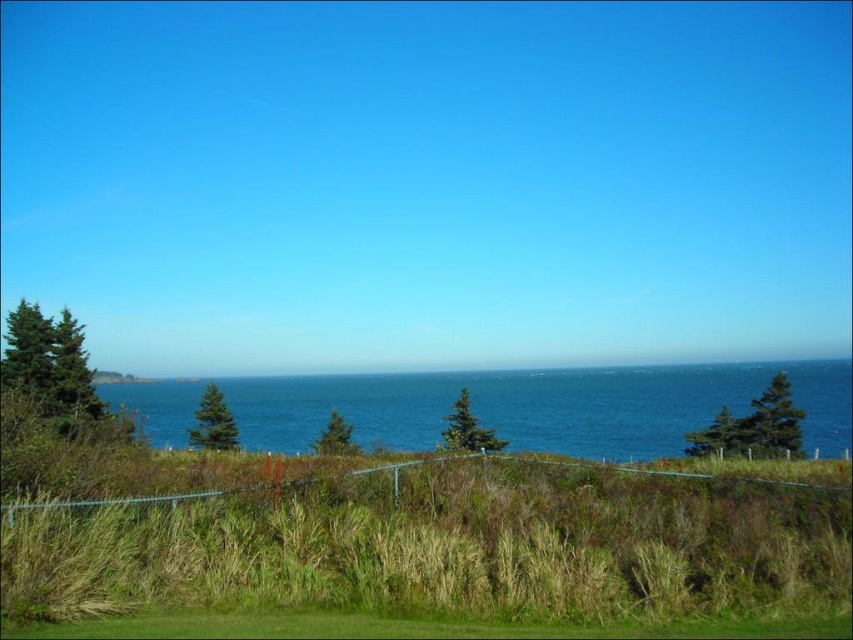
You are standing at the edge of a cliff overlooking the ocean. You see the green grassy at lower center and the blue water at center. Which one is closer to you?

The green grassy at lower center is closer to the viewer than the blue water at center.

You are standing at the edge of the grassy area and want to walk to the water. Based on the image, which area is narrower between the green grassy at lower center and the blue water at center?

The green grassy at lower center is narrower than the blue water at center.